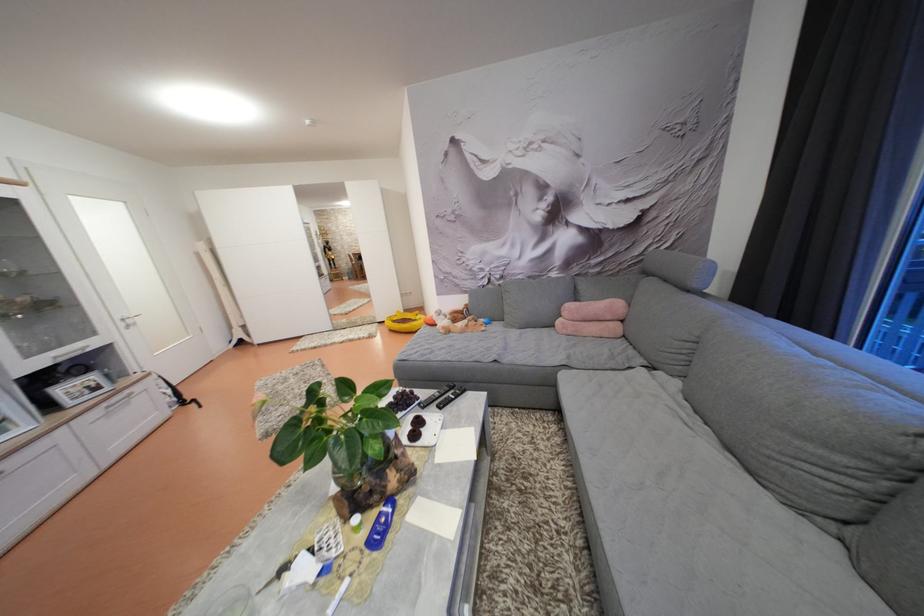
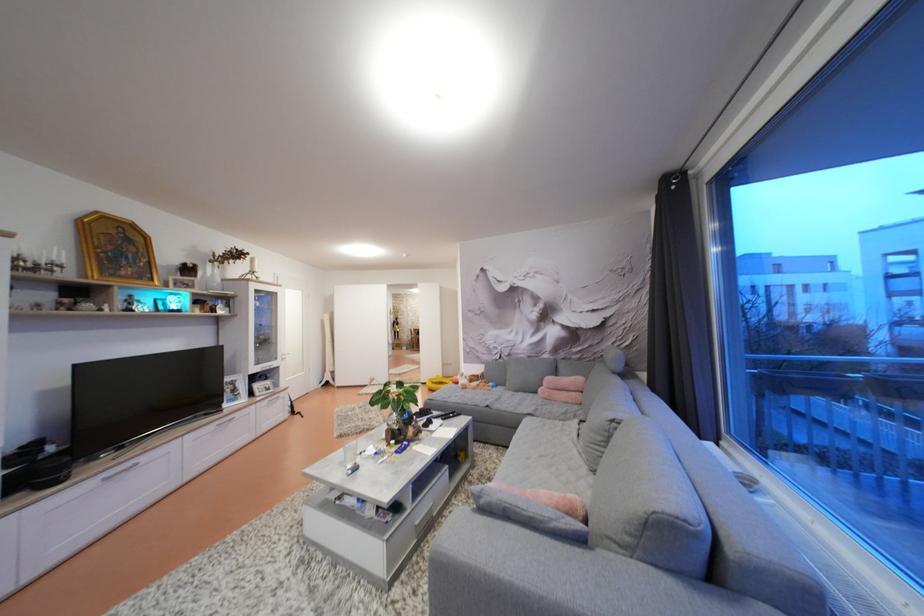
Locate, in the second image, the point that corresponds to (578,310) in the first image.

(556, 384)